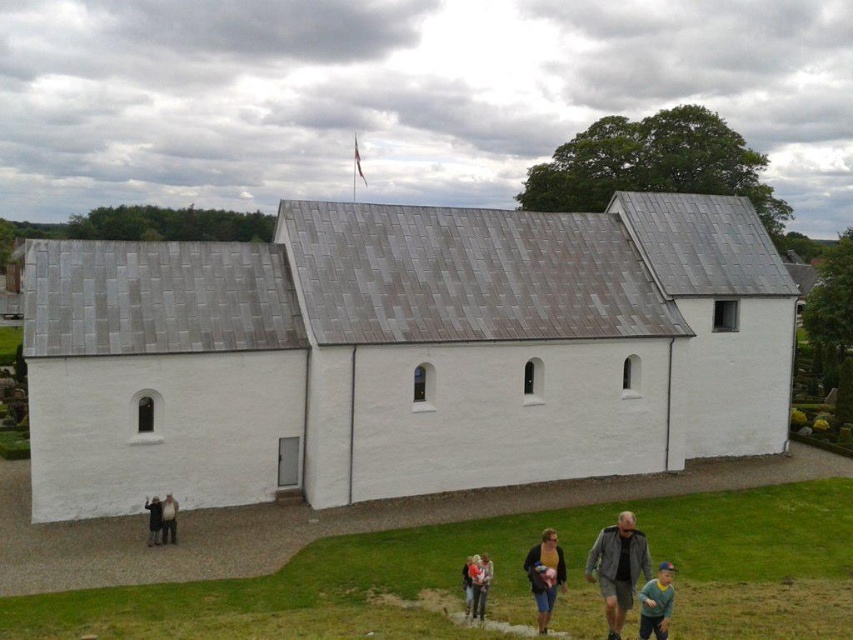
Does light brown fabric jacket at lower center come in front of dark gray wool coat at lower left?

Yes, light brown fabric jacket at lower center is in front of dark gray wool coat at lower left.

Does light brown fabric jacket at lower center lie behind dark gray wool coat at lower left?

That is False.

This screenshot has height=640, width=853. What do you see at coordinates (480, 586) in the screenshot?
I see `light brown fabric jacket at lower center` at bounding box center [480, 586].

I want to click on light brown fabric jacket at lower center, so click(x=480, y=586).

Does white smooth chapel at center appear on the left side of light brown leather jacket at lower center?

Yes, white smooth chapel at center is to the left of light brown leather jacket at lower center.

Does white smooth chapel at center appear under light brown leather jacket at lower center?

No, white smooth chapel at center is not below light brown leather jacket at lower center.

You are a GUI agent. You are given a task and a screenshot of the screen. Output one action in this format:
    pyautogui.click(x=<x>, y=<y>)
    Task: Click on the white smooth chapel at center
    The width and height of the screenshot is (853, 640).
    Given the screenshot: What is the action you would take?
    pyautogui.click(x=403, y=353)

Does gray fabric jacket at lower right have a greater width compared to light brown leather jacket at lower center?

Correct, the width of gray fabric jacket at lower right exceeds that of light brown leather jacket at lower center.

What do you see at coordinates (618, 568) in the screenshot?
I see `gray fabric jacket at lower right` at bounding box center [618, 568].

Identify the location of gray fabric jacket at lower right. (618, 568).